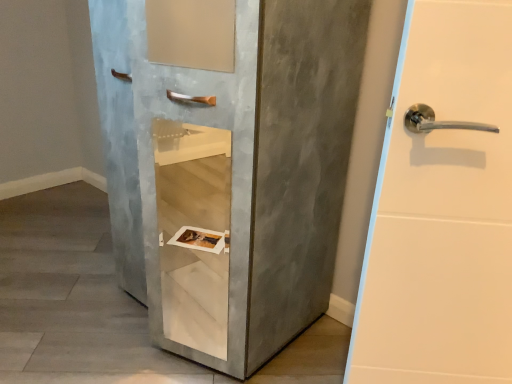
Question: Does matte gray cabinet at center have a smaller size compared to concrete textured cabinet at center?

Choices:
 (A) no
 (B) yes

Answer: (A)

Question: Can you confirm if matte gray cabinet at center is taller than concrete textured cabinet at center?

Choices:
 (A) no
 (B) yes

Answer: (B)

Question: Can we say matte gray cabinet at center lies outside concrete textured cabinet at center?

Choices:
 (A) no
 (B) yes

Answer: (B)

Question: Is matte gray cabinet at center in front of concrete textured cabinet at center?

Choices:
 (A) yes
 (B) no

Answer: (A)

Question: Can you confirm if matte gray cabinet at center is wider than concrete textured cabinet at center?

Choices:
 (A) yes
 (B) no

Answer: (B)

Question: Can you confirm if matte gray cabinet at center is shorter than concrete textured cabinet at center?

Choices:
 (A) yes
 (B) no

Answer: (B)

Question: Can you confirm if concrete textured cabinet at center is positioned to the right of matte gray cabinet at center?

Choices:
 (A) no
 (B) yes

Answer: (A)

Question: Is concrete textured cabinet at center positioned behind matte gray cabinet at center?

Choices:
 (A) yes
 (B) no

Answer: (A)

Question: From a real-world perspective, is concrete textured cabinet at center positioned over matte gray cabinet at center based on gravity?

Choices:
 (A) yes
 (B) no

Answer: (B)

Question: Does concrete textured cabinet at center have a greater height compared to matte gray cabinet at center?

Choices:
 (A) yes
 (B) no

Answer: (B)

Question: Is concrete textured cabinet at center oriented away from matte gray cabinet at center?

Choices:
 (A) yes
 (B) no

Answer: (B)

Question: Is concrete textured cabinet at center outside of matte gray cabinet at center?

Choices:
 (A) no
 (B) yes

Answer: (B)

Question: Visually, is concrete textured cabinet at center positioned to the left or to the right of matte gray cabinet at center?

Choices:
 (A) left
 (B) right

Answer: (A)